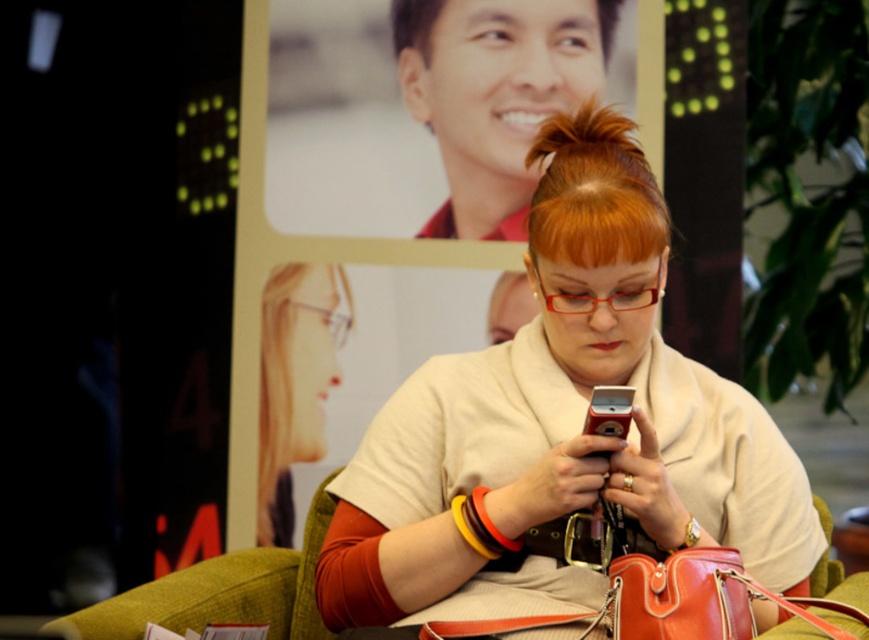
You are a fashion designer observing the scene. You need to decide which item can be worn by a model with a narrow face. Based on their sizes, which item between the matte beige sweater at center and the clear plastic glasses at upper left is more suitable?

The clear plastic glasses at upper left are smaller in size compared to the matte beige sweater at center, making them more suitable for a model with a narrow face.

You are a fashion designer observing the scene. You need to decide whether the matte beige sweater at center can completely cover the metallic silver phone at center without overlapping the edges. Can it?

The matte beige sweater at center might be wider than metallic silver phone at center, so there is a possibility that the sweater could cover the phone without overlapping the edges. However, this depends on the exact dimensions and positioning of both items.